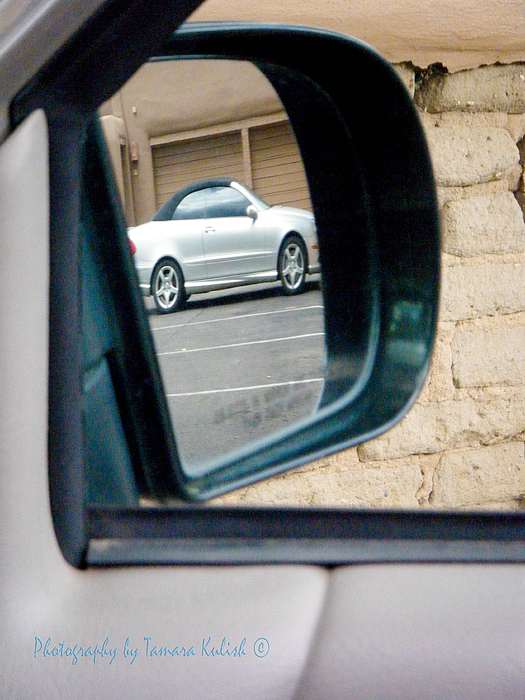
Identify the location of door handle. (211, 230).